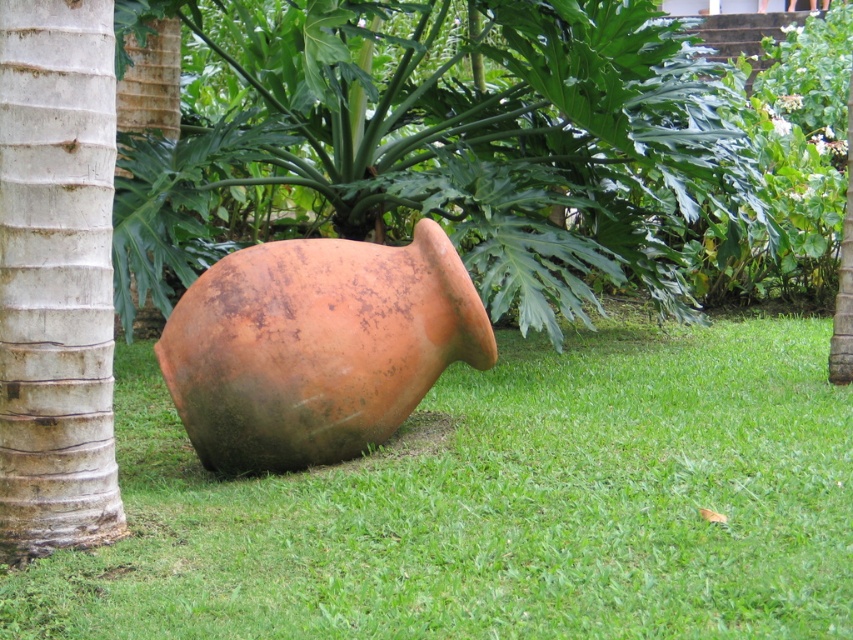
Question: Is the position of brown matte coconut tree at center less distant than that of white textured tree trunk at left?

Choices:
 (A) no
 (B) yes

Answer: (A)

Question: In this image, where is brown matte coconut tree at center located relative to white textured tree trunk at left?

Choices:
 (A) below
 (B) above

Answer: (B)

Question: Estimate the real-world distances between objects in this image. Which object is closer to the brown matte coconut tree at center?

Choices:
 (A) smooth brown bark at left
 (B) rusty clay pot at center

Answer: (A)

Question: Which of these objects is positioned closest to the smooth brown bark at left?

Choices:
 (A) green grass at lower center
 (B) brown matte coconut tree at center
 (C) white textured tree trunk at left

Answer: (B)

Question: Does rusty clay pot at center lie behind smooth brown bark at left?

Choices:
 (A) yes
 (B) no

Answer: (B)

Question: Which is farther from the white textured tree trunk at left?

Choices:
 (A) rusty clay pot at center
 (B) smooth brown bark at left

Answer: (B)